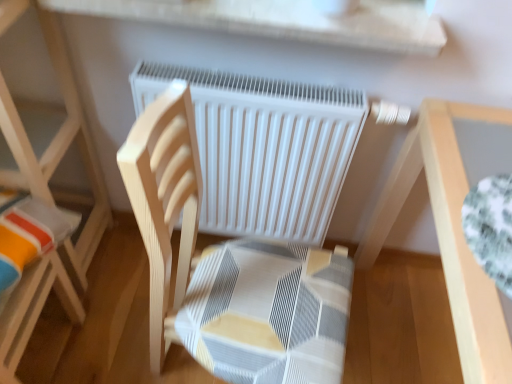
Question: Does white matte radiator at center have a greater width compared to wooden chair at center?

Choices:
 (A) no
 (B) yes

Answer: (A)

Question: Is white matte radiator at center turned away from wooden chair at center?

Choices:
 (A) yes
 (B) no

Answer: (A)

Question: Are white matte radiator at center and wooden chair at center making contact?

Choices:
 (A) yes
 (B) no

Answer: (B)

Question: Does white matte radiator at center have a lesser height compared to wooden chair at center?

Choices:
 (A) yes
 (B) no

Answer: (A)

Question: Is white matte radiator at center thinner than wooden chair at center?

Choices:
 (A) yes
 (B) no

Answer: (A)

Question: Is white matte radiator at center facing towards wooden chair at center?

Choices:
 (A) yes
 (B) no

Answer: (A)

Question: Is wooden chair at center far from white matte radiator at center?

Choices:
 (A) no
 (B) yes

Answer: (A)

Question: Is wooden chair at center shorter than white matte radiator at center?

Choices:
 (A) yes
 (B) no

Answer: (B)

Question: Is wooden chair at center smaller than white matte radiator at center?

Choices:
 (A) yes
 (B) no

Answer: (B)

Question: Does wooden chair at center have a greater width compared to white matte radiator at center?

Choices:
 (A) no
 (B) yes

Answer: (B)

Question: From the image's perspective, does wooden chair at center appear lower than white matte radiator at center?

Choices:
 (A) no
 (B) yes

Answer: (B)

Question: Does wooden chair at center appear on the right side of white matte radiator at center?

Choices:
 (A) no
 (B) yes

Answer: (A)

Question: Does light wood table at right appear on the left side of white matte radiator at center?

Choices:
 (A) yes
 (B) no

Answer: (B)